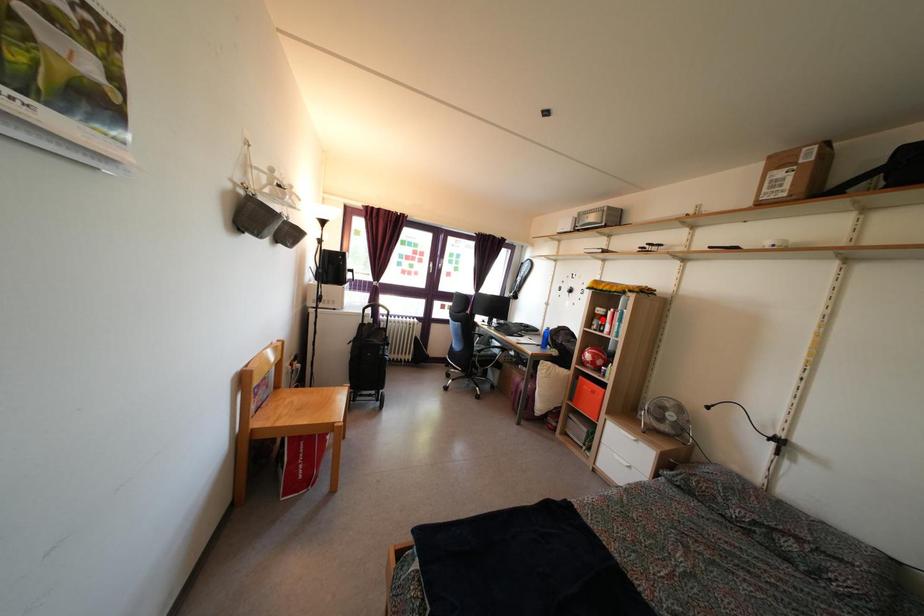
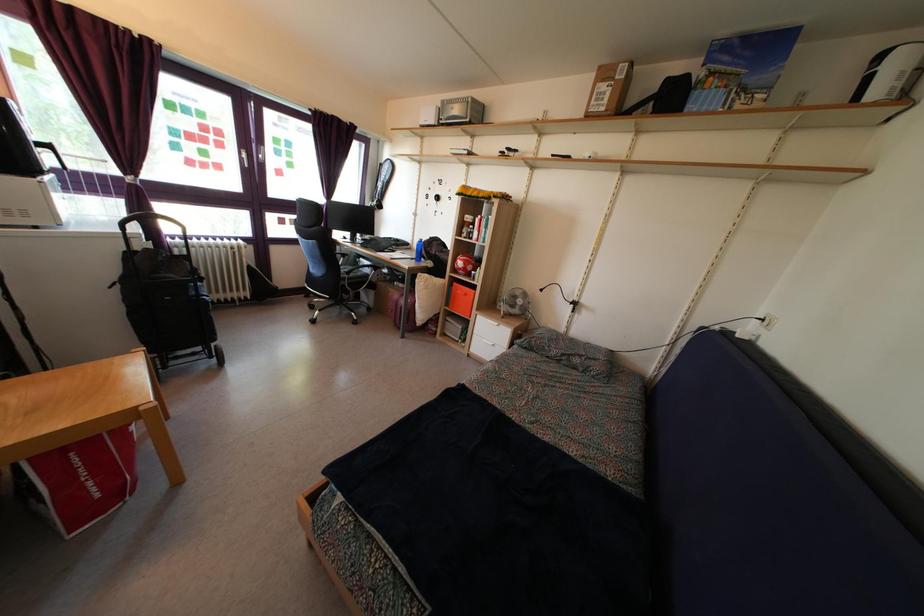
Locate, in the second image, the point that corresponds to the highlighted location in the first image.

(470, 227)